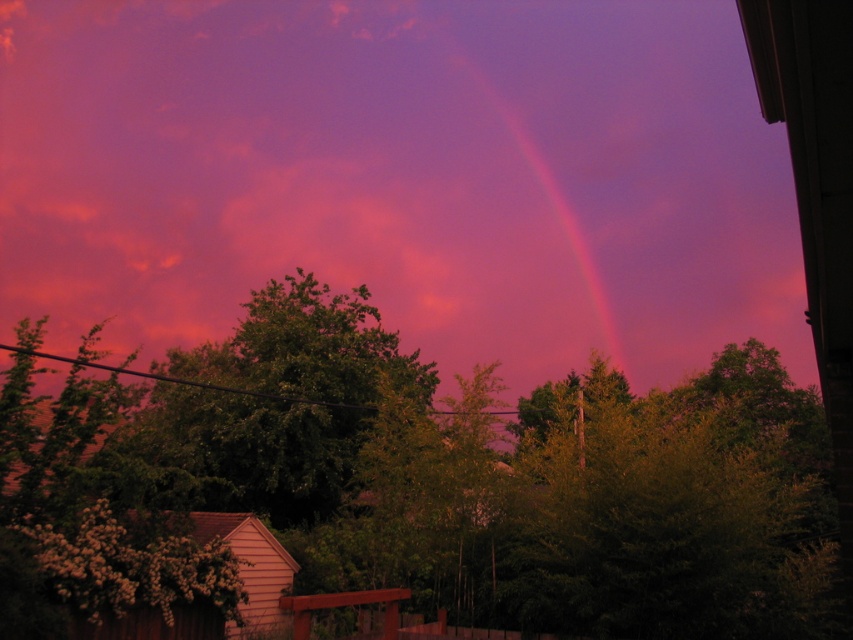
Does pink translucent cloud at upper center have a greater height compared to rainbow at upper center?

Indeed, pink translucent cloud at upper center has a greater height compared to rainbow at upper center.

Does pink translucent cloud at upper center have a lesser height compared to rainbow at upper center?

Incorrect, pink translucent cloud at upper center's height does not fall short of rainbow at upper center's.

Does point (724, 99) lie in front of point (567, 236)?

No, it is behind (567, 236).

Locate an element on the screen. pink translucent cloud at upper center is located at coordinates [x=401, y=177].